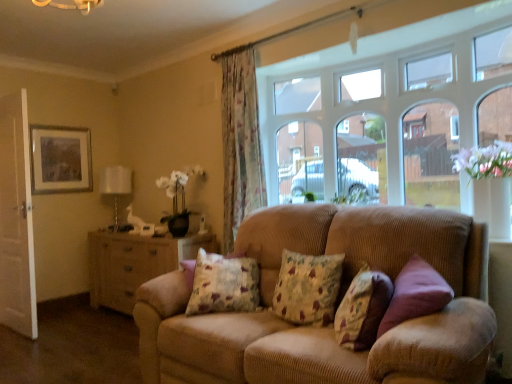
Image resolution: width=512 pixels, height=384 pixels. Describe the element at coordinates (307, 288) in the screenshot. I see `floral fabric cushion at center, marked as the 2th pillow in a right-to-left arrangement` at that location.

The width and height of the screenshot is (512, 384). What are the coordinates of `white wooden door at left` in the screenshot? It's located at (16, 219).

I want to click on floral fabric cushion at center, arranged as the first pillow when viewed from the left, so click(222, 284).

What do you see at coordinates (222, 284) in the screenshot?
I see `floral fabric cushion at center, arranged as the first pillow when viewed from the left` at bounding box center [222, 284].

Where is `corduroy couch at center`? corduroy couch at center is located at coordinates (337, 304).

Where is `floral fabric curtain at center`? The width and height of the screenshot is (512, 384). floral fabric curtain at center is located at coordinates tap(240, 142).

Image resolution: width=512 pixels, height=384 pixels. Find the location of `floral fabric cushion at center, marked as the 2th pillow in a right-to-left arrangement`. floral fabric cushion at center, marked as the 2th pillow in a right-to-left arrangement is located at coordinates (307, 288).

Is white wooden door at left spatially inside wooden dresser at left, or outside of it?

white wooden door at left exists outside the volume of wooden dresser at left.

You are a GUI agent. You are given a task and a screenshot of the screen. Output one action in this format:
    pyautogui.click(x=<x>, y=<y>)
    Task: Click on the screen door that appears in front of the wooden dresser at left
    The height and width of the screenshot is (384, 512).
    Given the screenshot: What is the action you would take?
    pyautogui.click(x=16, y=219)

Is wooden dresser at left at the back of white wooden door at left?

Yes, white wooden door at left's orientation is away from wooden dresser at left.

Between white wooden door at left and wooden dresser at left, which one has smaller width?

white wooden door at left.

In order to click on screen door behind the floral fabric cushion at center, the third pillow positioned from the right in this screenshot , I will do `click(16, 219)`.

Are white wooden door at left and floral fabric cushion at center, arranged as the first pillow when viewed from the left, located far from each other?

Yes, white wooden door at left is far from floral fabric cushion at center, arranged as the first pillow when viewed from the left.

In terms of size, does white wooden door at left appear bigger or smaller than floral fabric cushion at center, arranged as the first pillow when viewed from the left?

white wooden door at left is bigger than floral fabric cushion at center, arranged as the first pillow when viewed from the left.

Considering the relative sizes of white wooden door at left and floral fabric cushion at center, the third pillow positioned from the right, in the image provided, is white wooden door at left thinner than floral fabric cushion at center, the third pillow positioned from the right,?

Yes.

Which object is further away from the camera, corduroy couch at center or white wooden door at left?

Positioned behind is white wooden door at left.

How different are the orientations of corduroy couch at center and white wooden door at left in degrees?

The angle between the facing direction of corduroy couch at center and the facing direction of white wooden door at left is 1.1 degrees.

Considering the relative sizes of corduroy couch at center and white wooden door at left in the image provided, is corduroy couch at center wider than white wooden door at left?

Yes.

From the image's perspective, which one is positioned lower, green leafy plant at upper center or wooden dresser at left?

wooden dresser at left appears lower in the image.

Consider the image. Does green leafy plant at upper center touch wooden dresser at left?

No, green leafy plant at upper center is not making contact with wooden dresser at left.

This screenshot has height=384, width=512. In order to click on plant on the right of the wooden dresser at left in this screenshot , I will do `click(352, 197)`.

Is clear glass window at upper center oriented away from matte gold picture frame at upper left?

No.

At what (x,y) coordinates should I click in order to perform the action: click on window in front of the matte gold picture frame at upper left. Please return your answer as a coordinate pair (x, y). Looking at the image, I should click on (387, 87).

Can you tell me how much clear glass window at upper center and matte gold picture frame at upper left differ in facing direction?

clear glass window at upper center and matte gold picture frame at upper left are facing 89.3 degrees away from each other.

Who is more distant, clear glass window at upper center or matte gold picture frame at upper left?

Positioned behind is matte gold picture frame at upper left.

Which is behind, point (134, 249) or point (242, 290)?

The point (134, 249) is behind.

In the scene shown: How distant is wooden dresser at left from floral fabric cushion at center, arranged as the first pillow when viewed from the left?

wooden dresser at left and floral fabric cushion at center, arranged as the first pillow when viewed from the left, are 4.16 feet apart from each other.

Looking at the image, does wooden dresser at left seem bigger or smaller compared to floral fabric cushion at center, arranged as the first pillow when viewed from the left?

Considering their sizes, wooden dresser at left takes up more space than floral fabric cushion at center, arranged as the first pillow when viewed from the left.

Is wooden dresser at left spatially inside floral fabric cushion at center, arranged as the first pillow when viewed from the left, or outside of it?

wooden dresser at left is not enclosed by floral fabric cushion at center, arranged as the first pillow when viewed from the left.

Looking at this image, which of these two, floral fabric curtain at center or clear glass window at upper center, is thinner?

Thinner between the two is floral fabric curtain at center.

Is floral fabric curtain at center not inside clear glass window at upper center?

Yes.

Can you tell me how much floral fabric curtain at center and clear glass window at upper center differ in facing direction?

The facing directions of floral fabric curtain at center and clear glass window at upper center are 0.155 degrees apart.

Considering their positions, is floral fabric curtain at center located in front of or behind clear glass window at upper center?

Clearly, floral fabric curtain at center is behind clear glass window at upper center.

At what (x,y) coordinates should I click in order to perform the action: click on dresser behind the white wooden door at left. Please return your answer as a coordinate pair (x, y). Looking at the image, I should click on (134, 263).

Locate an element on the screen. This screenshot has width=512, height=384. the 1st pillow in front of the white wooden door at left is located at coordinates (222, 284).

Considering their positions, is wooden dresser at left positioned closer to floral fabric cushion at center, the first pillow from the right, than floral fabric curtain at center?

floral fabric curtain at center is positioned closer to the anchor floral fabric cushion at center, the first pillow from the right.

Looking at the image, which one is located further to white wooden door at left, floral fabric curtain at center or green leafy plant at upper center?

Based on the image, green leafy plant at upper center appears to be further to white wooden door at left.

From the image, which object appears to be nearer to matte gold picture frame at upper left, corduroy couch at center or floral fabric curtain at center?

floral fabric curtain at center is positioned closer to the anchor matte gold picture frame at upper left.

From the image, which object appears to be nearer to matte gold picture frame at upper left, green leafy plant at upper center or white wooden door at left?

white wooden door at left is positioned closer to the anchor matte gold picture frame at upper left.

From the image, which object appears to be nearer to floral fabric cushion at center, acting as the second pillow starting from the left, floral fabric cushion at center, arranged as the first pillow when viewed from the left, or white fabric lampshade at left?

floral fabric cushion at center, arranged as the first pillow when viewed from the left, lies closer to floral fabric cushion at center, acting as the second pillow starting from the left, than the other object.

When comparing their distances from corduroy couch at center, does matte gold picture frame at upper left or floral fabric curtain at center seem closer?

floral fabric curtain at center.

Based on their spatial positions, is wooden dresser at left or floral fabric curtain at center further from green leafy plant at upper center?

The object further to green leafy plant at upper center is wooden dresser at left.

Which object lies further to the anchor point wooden dresser at left, white wooden door at left or floral fabric curtain at center?

The object further to wooden dresser at left is floral fabric curtain at center.

This screenshot has width=512, height=384. I want to click on lamp between white wooden door at left and wooden dresser at left in the horizontal direction, so click(115, 185).

Where is `pillow between white wooden door at left and floral fabric curtain at center in the horizontal direction`? This screenshot has height=384, width=512. pillow between white wooden door at left and floral fabric curtain at center in the horizontal direction is located at coordinates (222, 284).

The height and width of the screenshot is (384, 512). I want to click on curtain between white wooden door at left and floral fabric cushion at center, acting as the second pillow starting from the left, from left to right, so tap(240, 142).

You are a GUI agent. You are given a task and a screenshot of the screen. Output one action in this format:
    pyautogui.click(x=<x>, y=<y>)
    Task: Click on the pillow between corduroy couch at center and floral fabric cushion at center, acting as the second pillow starting from the left, from front to back
    
    Given the screenshot: What is the action you would take?
    pyautogui.click(x=362, y=309)